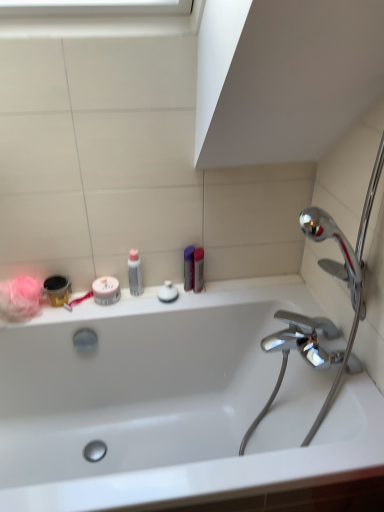
Locate an element on the screen. The height and width of the screenshot is (512, 384). free space in front of purple plastic container at upper center, which appears as the 1th toiletry when viewed from the right is located at coordinates (185, 305).